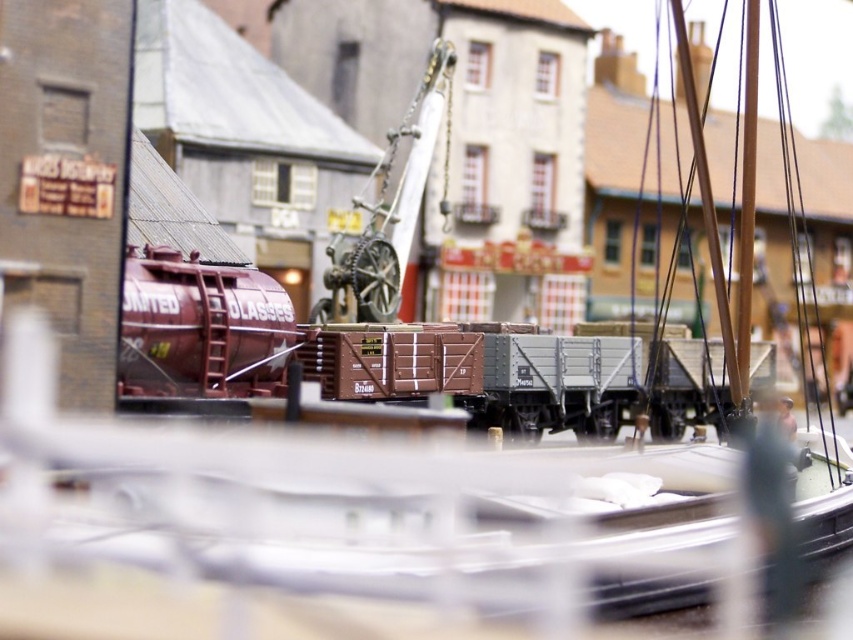
Can you confirm if maroon metallic tank car at center is smaller than metallic gray crane at center?

Incorrect, maroon metallic tank car at center is not smaller in size than metallic gray crane at center.

Locate an element on the screen. maroon metallic tank car at center is located at coordinates pos(248,337).